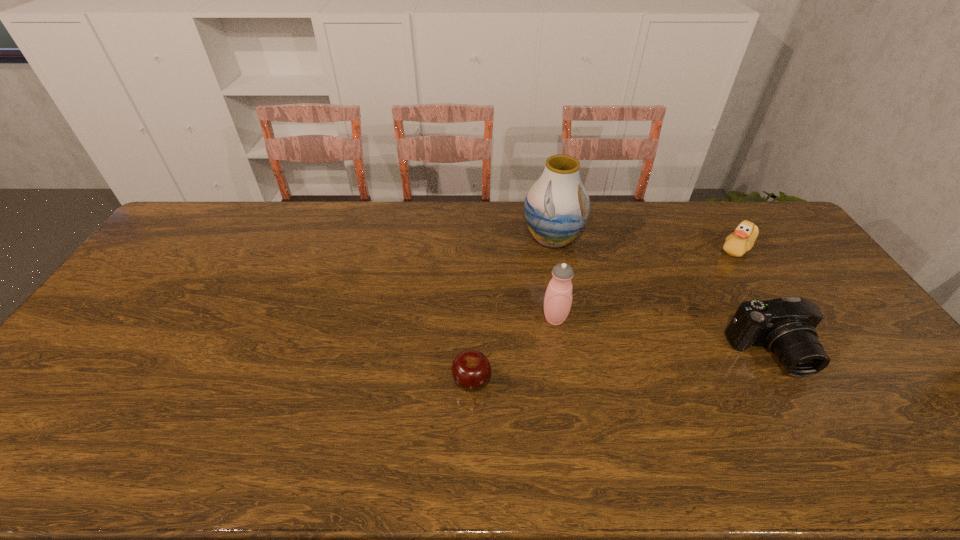
Identify the location of free space located 0.250m at the beak of the duck. (645, 248).

I want to click on free space located 0.150m at the beak of the duck, so click(674, 248).

The width and height of the screenshot is (960, 540). I want to click on vacant space positioned 0.210m at the beak of the duck, so click(657, 248).

The width and height of the screenshot is (960, 540). Identify the location of free space located on the back of the shortest object. (473, 283).

In order to click on vase that is at the far edge in this screenshot , I will do `click(557, 206)`.

This screenshot has height=540, width=960. I want to click on duck at the far edge, so click(736, 244).

Locate an element on the screen. The width and height of the screenshot is (960, 540). object that is at the right edge is located at coordinates (736, 244).

This screenshot has width=960, height=540. I want to click on object that is at the far right corner, so click(x=736, y=244).

In the image, there is a desktop. At what (x,y) coordinates should I click in order to perform the action: click on blank space at the far edge. Please return your answer as a coordinate pair (x, y). Looking at the image, I should click on (520, 236).

In the image, there is a desktop. Where is `free region at the left edge`? The width and height of the screenshot is (960, 540). free region at the left edge is located at coordinates (124, 359).